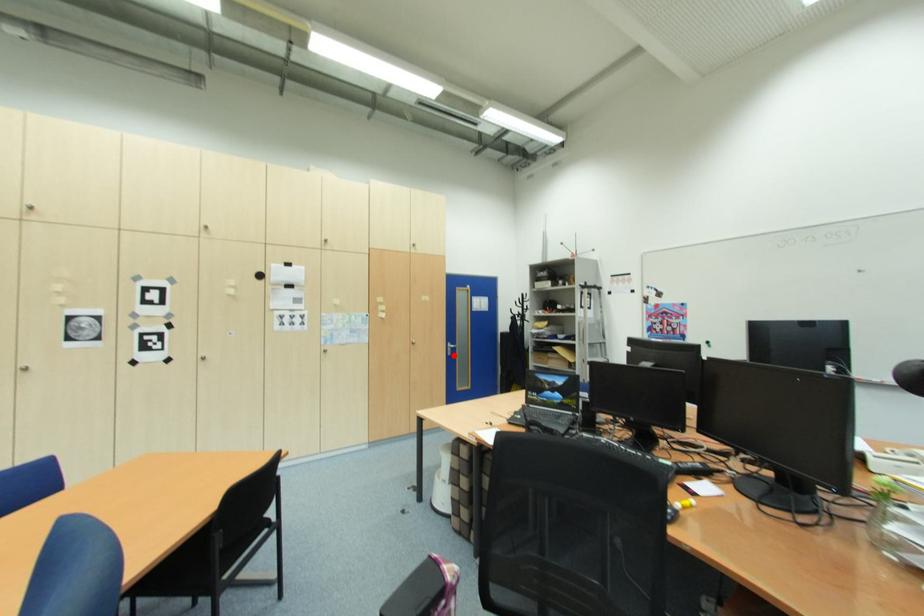
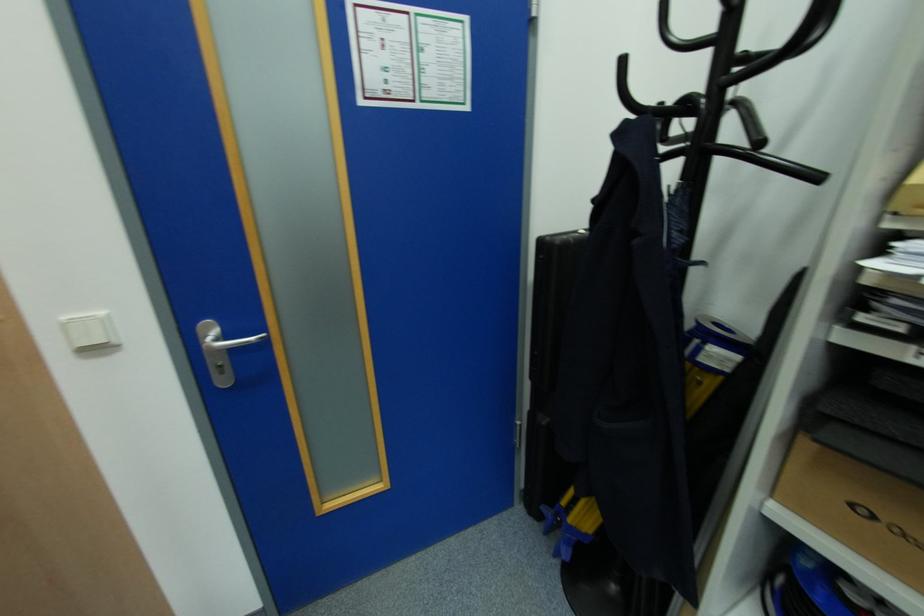
Where in the second image is the point corresponding to the highlighted location from the first image?

(227, 382)